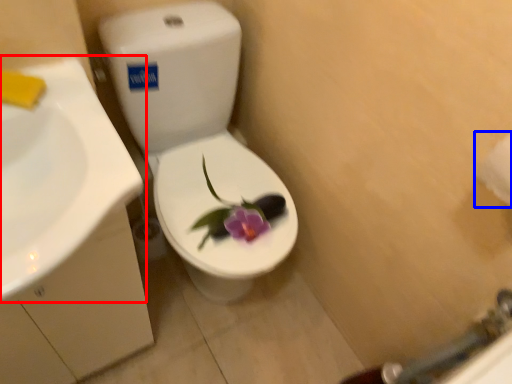
Question: Among these objects, which one is nearest to the camera, sink (highlighted by a red box) or toilet paper (highlighted by a blue box)?

Choices:
 (A) sink
 (B) toilet paper

Answer: (A)